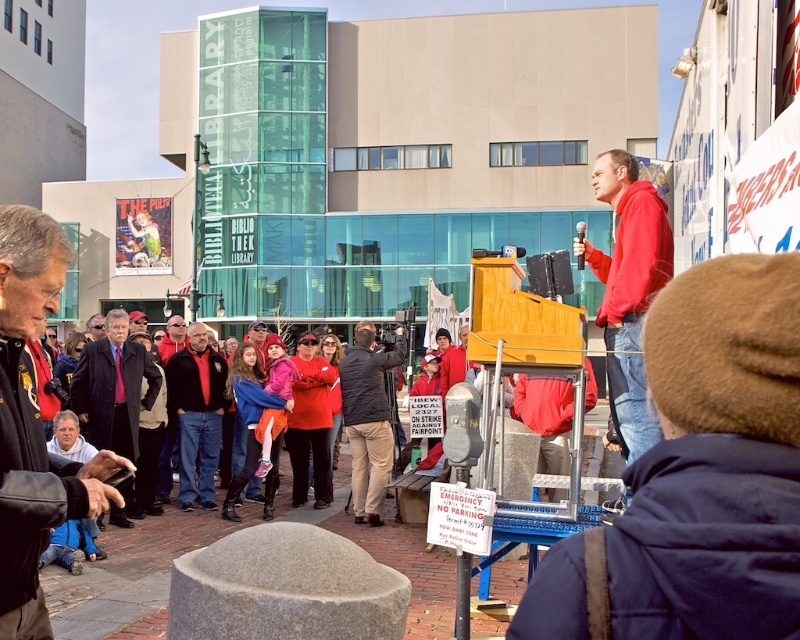
You are organizing a small event and need to know if two participants, one wearing a red hoodie at center and another in a dark blue suit at left, can hear each other without shouting. The minimum comfortable distance for conversation without shouting is 5 meters. Based on the scene, what would you advise?

The distance between the red hoodie at center and the dark blue suit at left is 6.27 meters. Since this exceeds the 5 meters minimum comfortable distance for conversation, they may need to raise their voices slightly to hear each other comfortably.

You are organizing a photo shoot and need to ensure the black leather jacket at lower left and the red jacket at center are in the same frame. The camera has a maximum focal length that allows capturing objects up to 30 feet apart in the same shot. Will you be able to include both jackets in one photo?

The black leather jacket at lower left and red jacket at center are 32.51 feet apart, which exceeds the camera maximum focal length of 30 feet. Therefore, you cannot include both jackets in one photo.

You are a photographer trying to capture a photo of the khaki pants at center and the red fabric jacket at center. Which one should you zoom in on to make them appear the same size in the photo?

The khaki pants at center is smaller than the red fabric jacket at center, so you should zoom in more on the khaki pants at center to make them appear the same size in the photo.